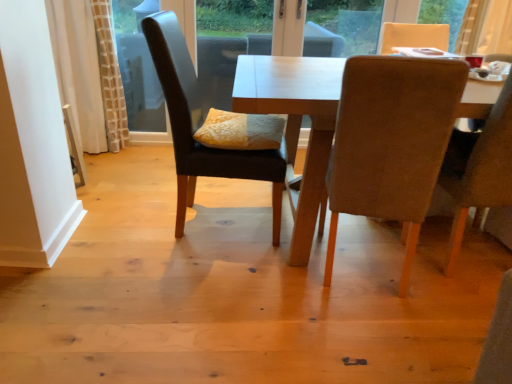
This screenshot has width=512, height=384. What are the coordinates of `vacant area that lies between velvet beige chair at right, which is the 2th chair in right-to-left order, and beige fabric chair at right, placed as the 1th chair when sorted from right to left` in the screenshot? It's located at (443, 289).